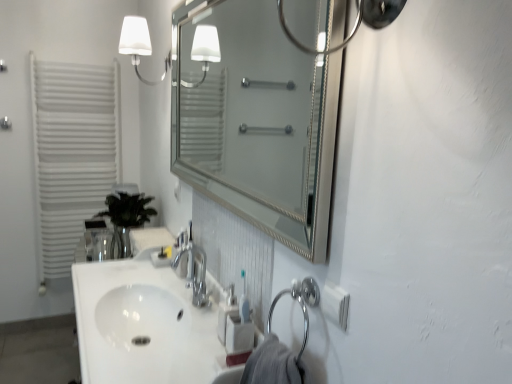
Question: Is white matte wall sconce at upper left positioned behind green glass vase at left?

Choices:
 (A) no
 (B) yes

Answer: (A)

Question: Is white matte wall sconce at upper left aimed at green glass vase at left?

Choices:
 (A) no
 (B) yes

Answer: (A)

Question: Is white matte wall sconce at upper left to the left of green glass vase at left from the viewer's perspective?

Choices:
 (A) no
 (B) yes

Answer: (A)

Question: Considering the relative sizes of white matte wall sconce at upper left and green glass vase at left in the image provided, is white matte wall sconce at upper left taller than green glass vase at left?

Choices:
 (A) no
 (B) yes

Answer: (A)

Question: Is white matte wall sconce at upper left positioned in front of green glass vase at left?

Choices:
 (A) yes
 (B) no

Answer: (A)

Question: Is green glass vase at left completely or partially inside white matte wall sconce at upper left?

Choices:
 (A) no
 (B) yes

Answer: (A)

Question: Is the depth of white matte wall sconce at upper left less than that of white glossy sink at center, the second sink in the top-to-bottom sequence?

Choices:
 (A) no
 (B) yes

Answer: (A)

Question: Is white matte wall sconce at upper left turned away from white glossy sink at center, which is counted as the 1th sink, starting from the bottom?

Choices:
 (A) no
 (B) yes

Answer: (A)

Question: From a real-world perspective, is white matte wall sconce at upper left beneath white glossy sink at center, which is counted as the 1th sink, starting from the bottom?

Choices:
 (A) no
 (B) yes

Answer: (A)

Question: Is the surface of white matte wall sconce at upper left in direct contact with white glossy sink at center, the second sink in the top-to-bottom sequence?

Choices:
 (A) yes
 (B) no

Answer: (B)

Question: From the image's perspective, would you say white matte wall sconce at upper left is positioned over white glossy sink at center, the second sink in the top-to-bottom sequence?

Choices:
 (A) no
 (B) yes

Answer: (B)

Question: Can you confirm if white matte wall sconce at upper left is bigger than white glossy sink at center, the second sink in the top-to-bottom sequence?

Choices:
 (A) no
 (B) yes

Answer: (A)

Question: Could you tell me if polished chrome faucet at center is facing white plastic soap dispenser at lower center?

Choices:
 (A) no
 (B) yes

Answer: (A)